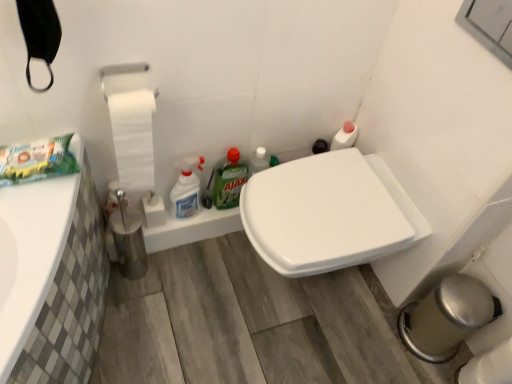
Question: Is white glossy spray bottle at center, arranged as the second cleaning product when viewed from the right, looking in the opposite direction of white matte toilet paper at left?

Choices:
 (A) yes
 (B) no

Answer: (B)

Question: Considering the relative sizes of white glossy spray bottle at center, arranged as the second cleaning product when viewed from the right, and white matte toilet paper at left in the image provided, is white glossy spray bottle at center, arranged as the second cleaning product when viewed from the right, thinner than white matte toilet paper at left?

Choices:
 (A) yes
 (B) no

Answer: (B)

Question: Is the depth of white glossy spray bottle at center, arranged as the second cleaning product when viewed from the right, less than that of white matte toilet paper at left?

Choices:
 (A) yes
 (B) no

Answer: (B)

Question: Does white glossy spray bottle at center, arranged as the second cleaning product when viewed from the right, appear on the left side of white matte toilet paper at left?

Choices:
 (A) yes
 (B) no

Answer: (B)

Question: From the image's perspective, would you say white glossy spray bottle at center, arranged as the second cleaning product when viewed from the right, is positioned over white matte toilet paper at left?

Choices:
 (A) no
 (B) yes

Answer: (A)

Question: Is white glossy toilet seat at center in front of or behind white glossy spray bottle at center, the first cleaning product in the left-to-right sequence, in the image?

Choices:
 (A) front
 (B) behind

Answer: (A)

Question: From the image's perspective, is white glossy toilet seat at center positioned above or below white glossy spray bottle at center, arranged as the second cleaning product when viewed from the right?

Choices:
 (A) below
 (B) above

Answer: (A)

Question: Looking at their shapes, would you say white glossy toilet seat at center is wider or thinner than white glossy spray bottle at center, arranged as the second cleaning product when viewed from the right?

Choices:
 (A) thin
 (B) wide

Answer: (B)

Question: In terms of size, does white glossy toilet seat at center appear bigger or smaller than white glossy spray bottle at center, arranged as the second cleaning product when viewed from the right?

Choices:
 (A) big
 (B) small

Answer: (A)

Question: From the image's perspective, is white glossy toilet seat at center located above or below white matte toilet paper at left?

Choices:
 (A) above
 (B) below

Answer: (B)

Question: Considering the positions of white glossy toilet seat at center and white matte toilet paper at left in the image, is white glossy toilet seat at center wider or thinner than white matte toilet paper at left?

Choices:
 (A) thin
 (B) wide

Answer: (B)

Question: From a real-world perspective, is white glossy toilet seat at center above or below white matte toilet paper at left?

Choices:
 (A) below
 (B) above

Answer: (A)

Question: Is point (379, 236) closer or farther from the camera than point (142, 145)?

Choices:
 (A) farther
 (B) closer

Answer: (A)

Question: From their relative heights in the image, would you say green matte ajax at center, the first cleaning product when ordered from right to left, is taller or shorter than white glossy spray bottle at center, the first cleaning product in the left-to-right sequence?

Choices:
 (A) short
 (B) tall

Answer: (A)

Question: Is green matte ajax at center, arranged as the 2th cleaning product when viewed from the left, in front of or behind white glossy spray bottle at center, arranged as the second cleaning product when viewed from the right, in the image?

Choices:
 (A) behind
 (B) front

Answer: (A)